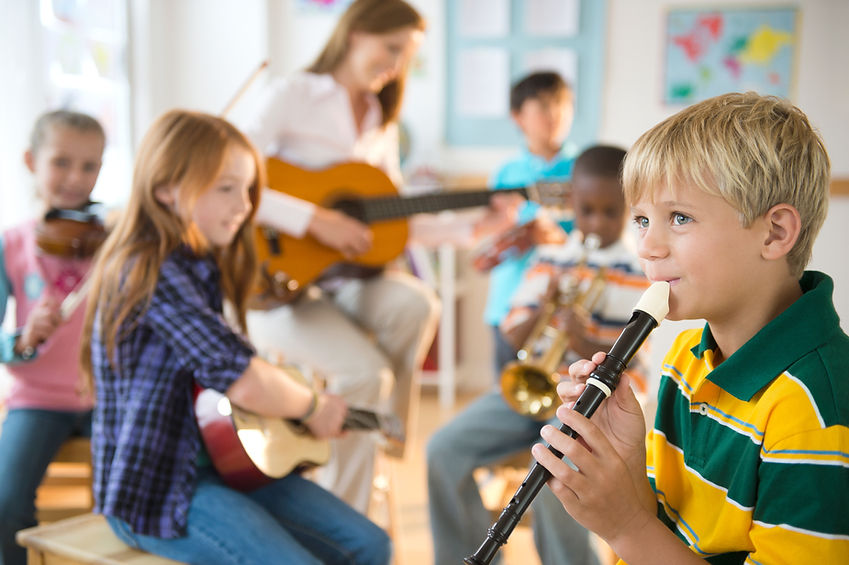
The image size is (849, 565). I want to click on white wall, so click(187, 53), click(628, 56).